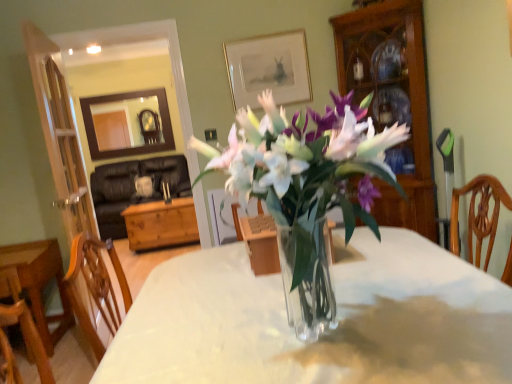
Question: From the image's perspective, is wooden cabinet at right positioned above or below gold-framed picture at upper center?

Choices:
 (A) above
 (B) below

Answer: (B)

Question: Relative to gold-framed picture at upper center, is wooden cabinet at right in front or behind?

Choices:
 (A) front
 (B) behind

Answer: (A)

Question: Based on their relative distances, which object is nearer to the wooden cabinet at right?

Choices:
 (A) clear glass vase at center
 (B) gold-framed picture at upper center
 (C) wooden table at lower left, the second table from the back
 (D) transparent glass vase at center
 (E) wooden chest at center, which ranks as the second table in front-to-back order

Answer: (B)

Question: Considering the real-world distances, which object is closest to the wooden chest at center, which ranks as the 1th table in back-to-front order?

Choices:
 (A) transparent glass vase at center
 (B) wooden cabinet at right
 (C) clear glass vase at center
 (D) wooden table at lower left, the second table from the back
 (E) gold-framed picture at upper center

Answer: (D)